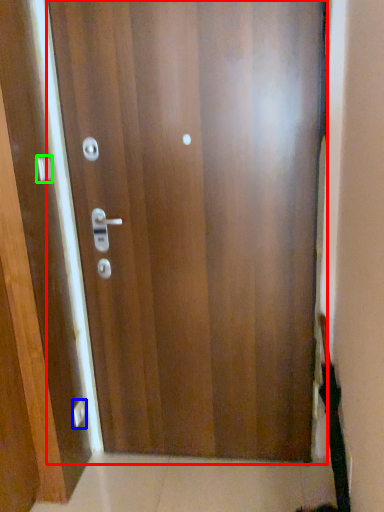
Question: Based on their relative distances, which object is farther from door (highlighted by a red box)? Choose from knob (highlighted by a blue box) and handle (highlighted by a green box).

Choices:
 (A) knob
 (B) handle

Answer: (A)